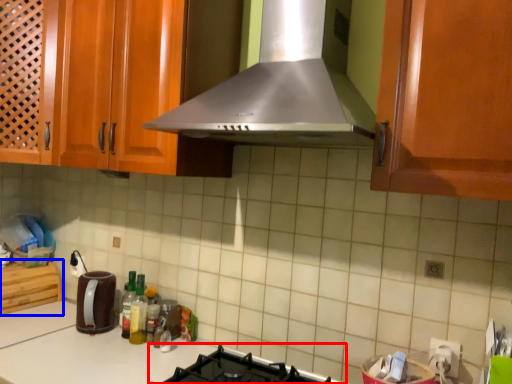
Question: Which of the following is the closest to the observer, gas stove (highlighted by a red box) or cabinetry (highlighted by a blue box)?

Choices:
 (A) gas stove
 (B) cabinetry

Answer: (A)